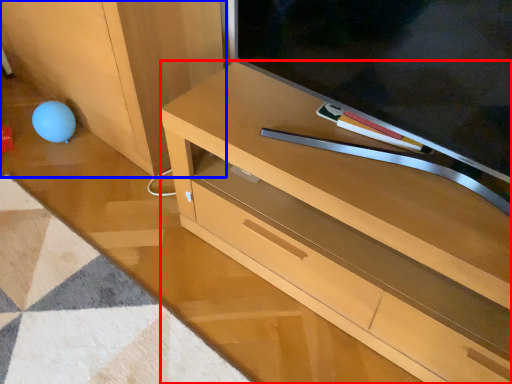
Question: Which object appears closest to the camera in this image, desk (highlighted by a red box) or cabinetry (highlighted by a blue box)?

Choices:
 (A) desk
 (B) cabinetry

Answer: (A)